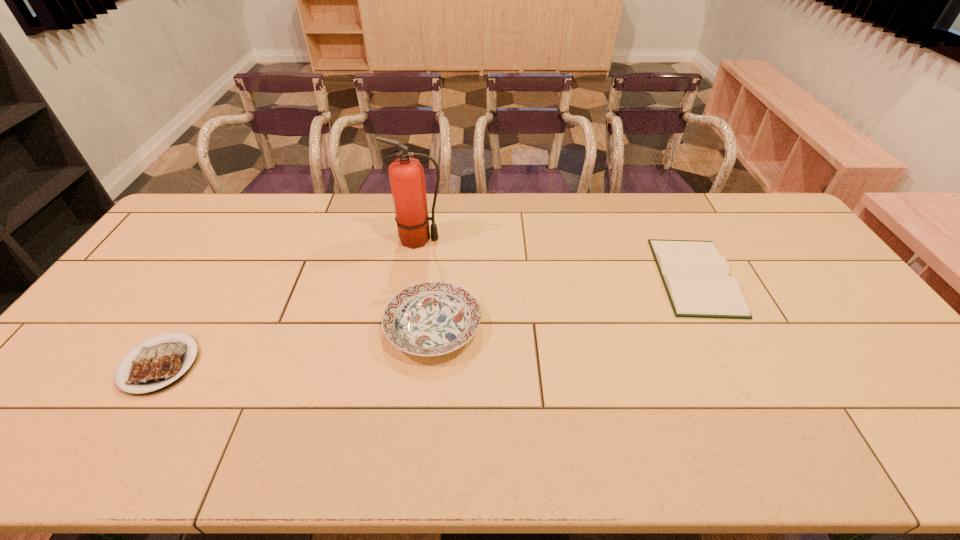
This screenshot has width=960, height=540. I want to click on object positioned at the far edge, so click(406, 174).

Locate an element on the screen. object that is at the left edge is located at coordinates (157, 365).

Image resolution: width=960 pixels, height=540 pixels. I want to click on vacant region at the far edge of the desktop, so 642,226.

The height and width of the screenshot is (540, 960). Identify the location of vacant position at the near edge of the desktop. (249, 441).

In the image, there is a desktop. Find the location of `free space at the left edge`. free space at the left edge is located at coordinates (198, 253).

The image size is (960, 540). I want to click on vacant region at the right edge of the desktop, so click(x=812, y=268).

Locate an element on the screen. free region at the far right corner of the desktop is located at coordinates (729, 206).

I want to click on free area in between the tallest object and the hardback book, so click(557, 258).

Locate an element on the screen. Image resolution: width=960 pixels, height=540 pixels. empty space between the taller plate and the left plate is located at coordinates (297, 345).

You are a GUI agent. You are given a task and a screenshot of the screen. Output one action in this format:
    pyautogui.click(x=<x>, y=<y>)
    Task: Click on the free space between the taller plate and the shorter plate
    
    Given the screenshot: What is the action you would take?
    pyautogui.click(x=297, y=345)